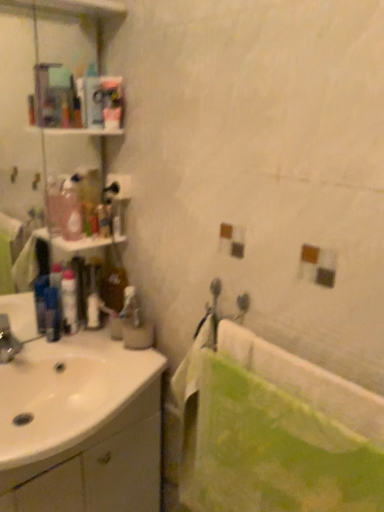
Where is `vacant area that is situated to the right of metallic silver faucet at left`? vacant area that is situated to the right of metallic silver faucet at left is located at coordinates (51, 368).